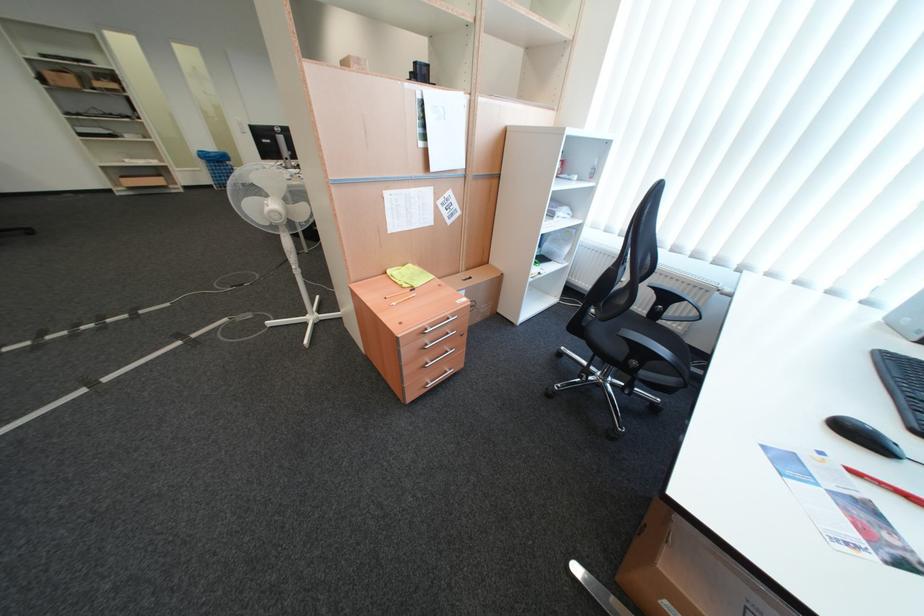
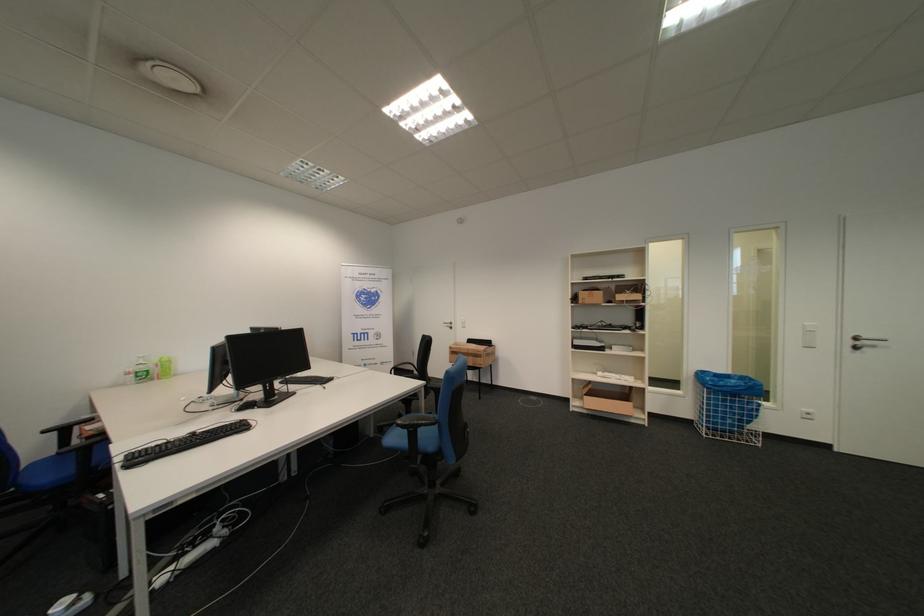
Locate, in the second image, the point that corresponds to (227,168) in the first image.

(736, 402)